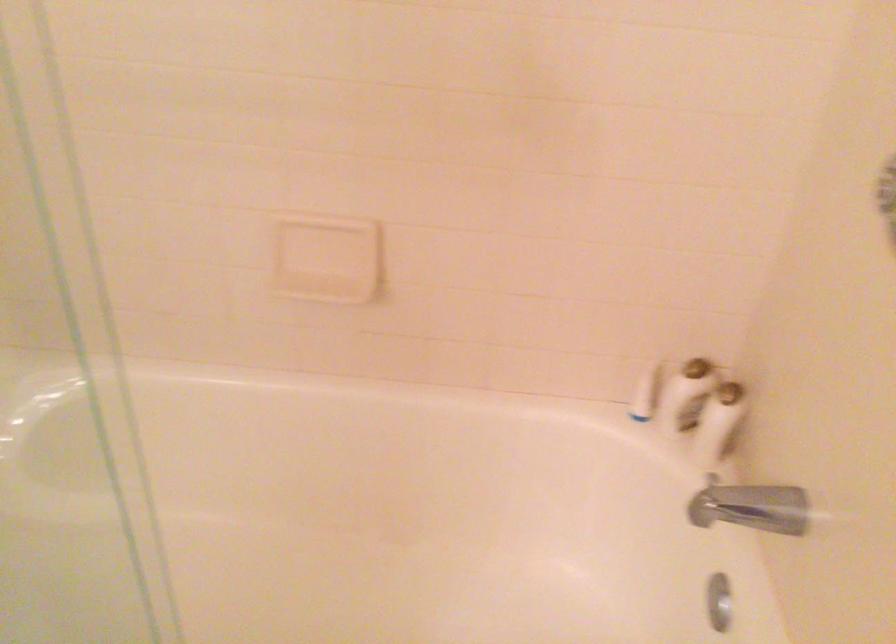
Identify the location of faucet diverter knob. (719, 601).